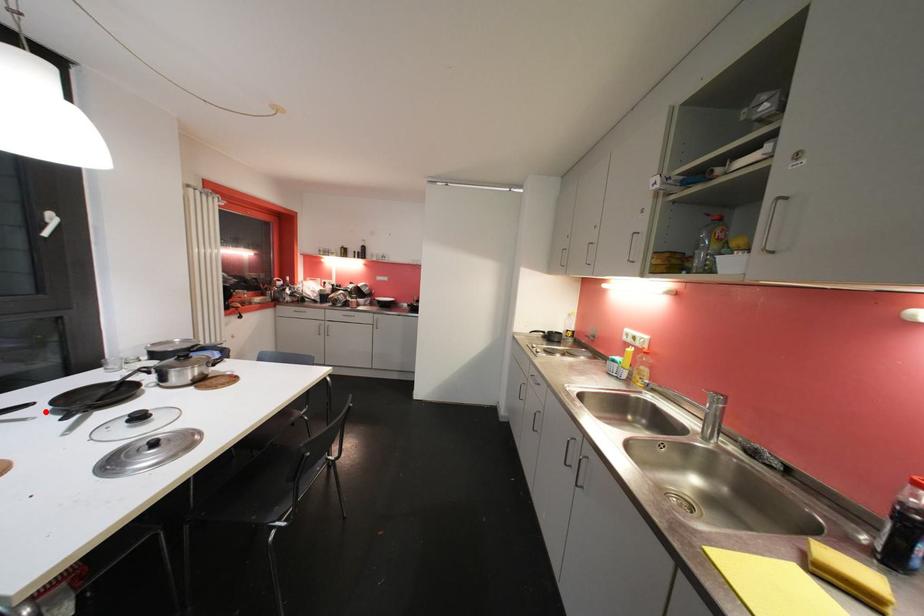
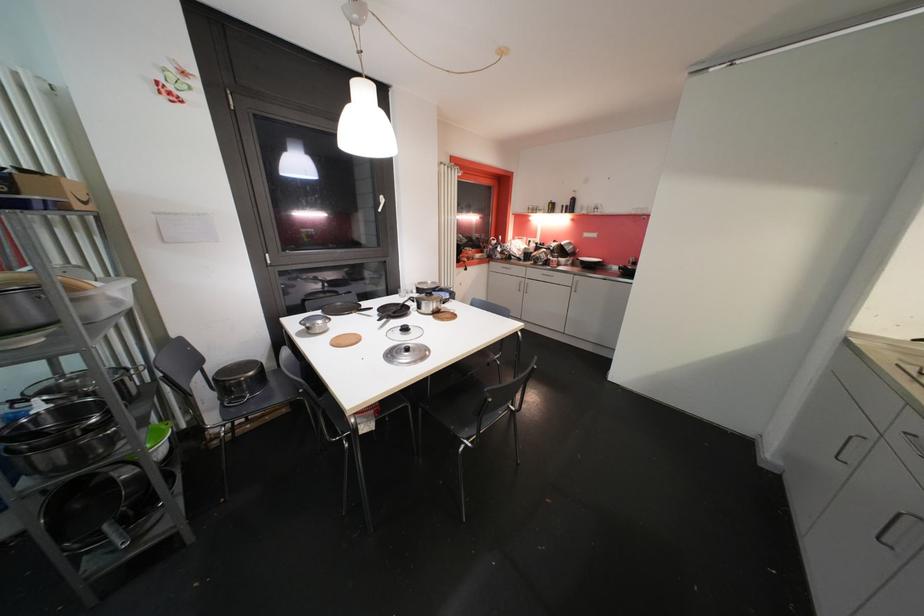
Where in the second image is the point corresponding to the highlighted location from the first image?

(379, 315)